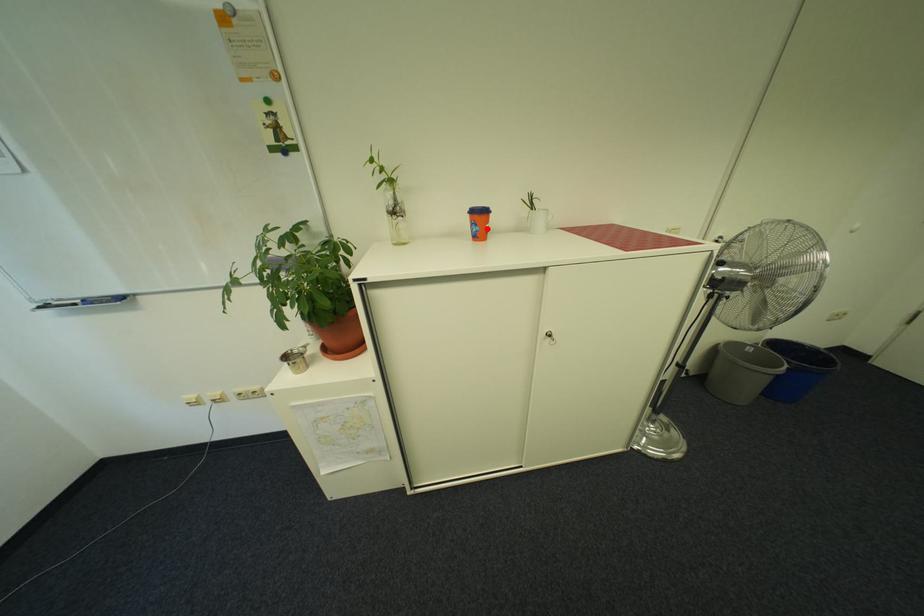
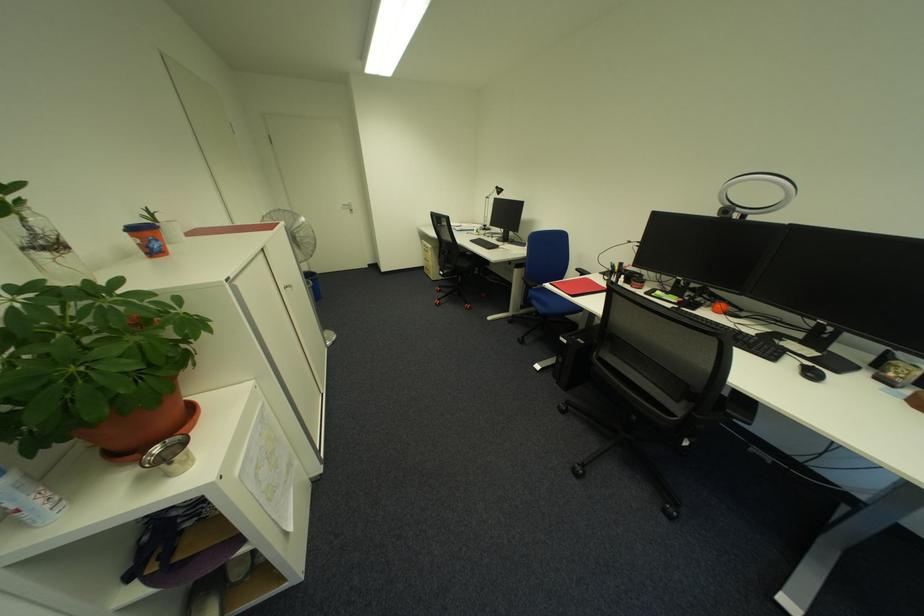
Question: I am providing you with two images of the same scene from different viewpoints. A red point is marked on the first image. Is the red point's position out of view in image 2?

Choices:
 (A) Yes
 (B) No

Answer: (B)